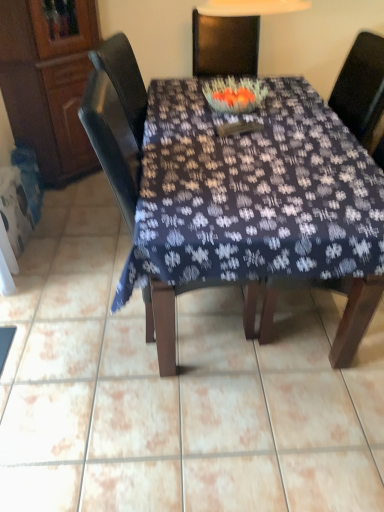
Where is `vacant space in front of wooden cabinet at left`? vacant space in front of wooden cabinet at left is located at coordinates (86, 214).